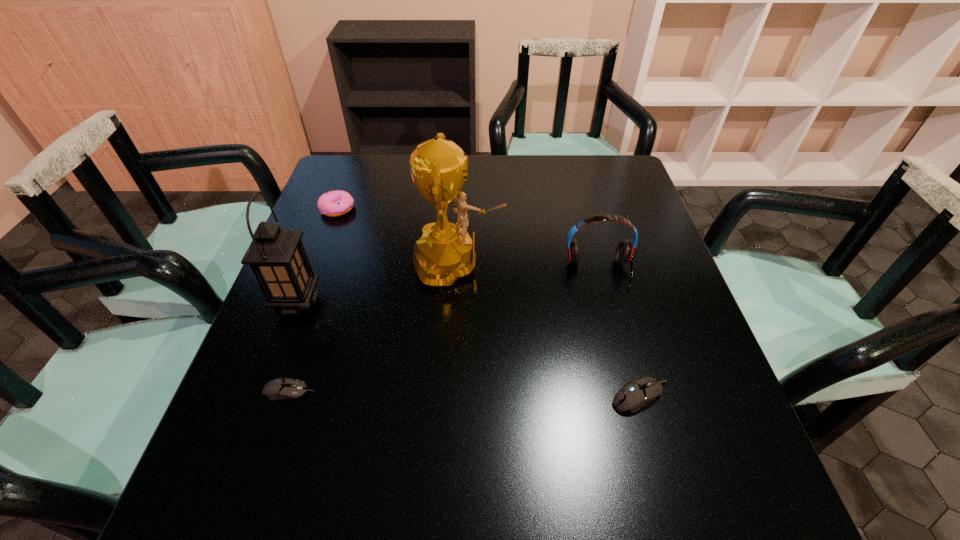
Point out which object is positioned as the second nearest to the headset. Please provide its 2D coordinates. Your answer should be formatted as a tuple, i.e. [(x, y)], where the tuple contains the x and y coordinates of a point satisfying the conditions above.

[(635, 393)]

Find the location of `object identified as the closest to the taller computer mouse`. object identified as the closest to the taller computer mouse is located at coordinates (624, 252).

The image size is (960, 540). What are the coordinates of `free space that satisfies the following two spatial constraints: 1. with the microphone attached to the side of the headset; 2. on the right side of the second shortest object` in the screenshot? It's located at (631, 396).

Locate an element on the screen. Image resolution: width=960 pixels, height=540 pixels. vacant point that satisfies the following two spatial constraints: 1. on the back side of the taller computer mouse; 2. on the front side of the third object from right to left is located at coordinates (603, 264).

Image resolution: width=960 pixels, height=540 pixels. Identify the location of vacant point that satisfies the following two spatial constraints: 1. on the front side of the taller computer mouse; 2. on the right side of the farthest object. (268, 396).

Identify the location of vacant space that satisfies the following two spatial constraints: 1. on the front side of the right computer mouse; 2. on the right side of the award. The width and height of the screenshot is (960, 540). (451, 396).